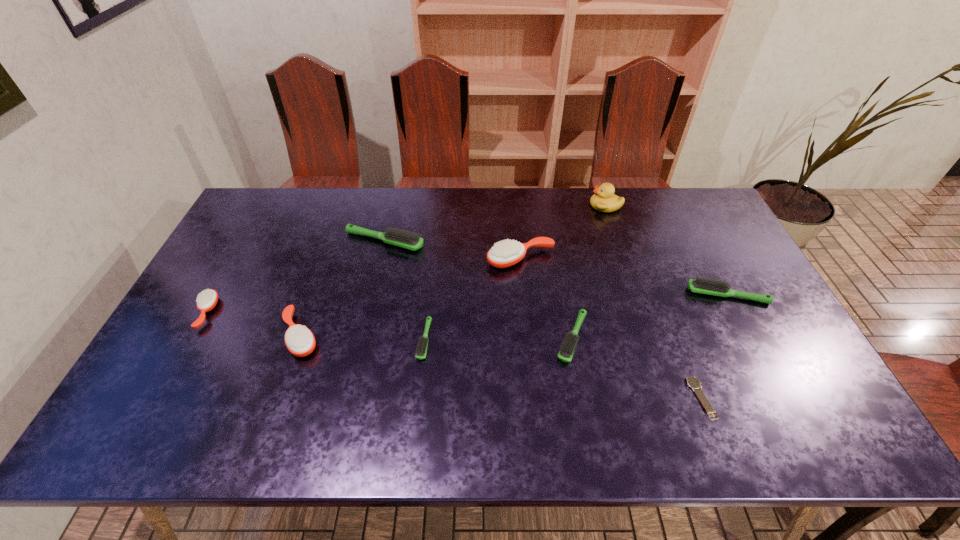
Find the location of `object that is at the near edge`. object that is at the near edge is located at coordinates (692, 381).

Image resolution: width=960 pixels, height=540 pixels. Identify the location of object that is at the left edge. (206, 301).

This screenshot has width=960, height=540. What are the coordinates of `object located at the right edge` in the screenshot? It's located at (701, 285).

In the image, there is a desktop. Identify the location of free space at the far edge. Image resolution: width=960 pixels, height=540 pixels. (550, 188).

Find the location of a particular element. Image resolution: width=960 pixels, height=540 pixels. blank space at the near edge is located at coordinates (302, 420).

At what (x,y) coordinates should I click in order to perform the action: click on free space at the left edge of the desktop. Please return your answer as a coordinate pair (x, y). This screenshot has height=540, width=960. Looking at the image, I should click on tap(168, 348).

This screenshot has width=960, height=540. What are the coordinates of `vacant space at the right edge of the desktop` in the screenshot? It's located at (682, 233).

In the image, there is a desktop. Identify the location of vacant space at the far left corner. (283, 202).

Where is `free location at the far right corner`? free location at the far right corner is located at coordinates (676, 218).

The width and height of the screenshot is (960, 540). In order to click on free space between the second farthest light hairbrush and the eighth shortest object in this screenshot , I will do `click(624, 277)`.